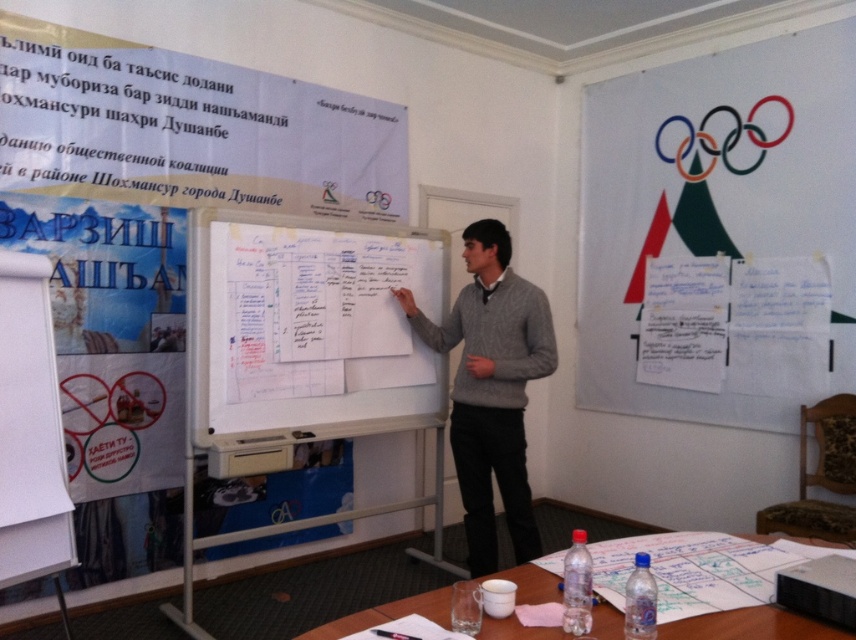
Question: Which of the following is the farthest from the observer?

Choices:
 (A) gray sweater at center
 (B) white paperboard at upper left
 (C) white paper at center

Answer: (A)

Question: Is white paperboard at upper left bigger than gray sweater at center?

Choices:
 (A) no
 (B) yes

Answer: (B)

Question: Which point is farther to the camera?

Choices:
 (A) white paper at lower center
 (B) white paper at center

Answer: (B)

Question: Is gray sweater at center wider than white paper at lower center?

Choices:
 (A) yes
 (B) no

Answer: (B)

Question: Is white paperboard at upper left to the left of white paper at upper right from the viewer's perspective?

Choices:
 (A) yes
 (B) no

Answer: (A)

Question: Among these points, which one is nearest to the camera?

Choices:
 (A) (547, 584)
 (B) (538, 540)
 (C) (79, 140)
 (D) (740, 65)

Answer: (A)